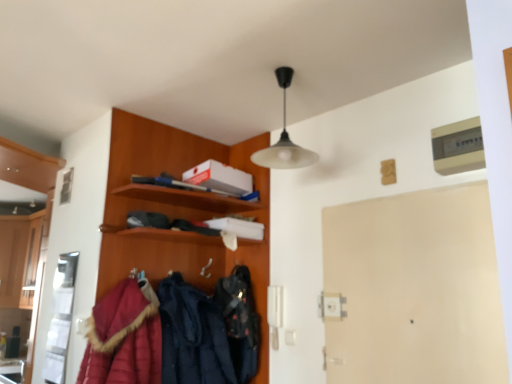
Question: Should I look upward or downward to see velvet black bag at center, acting as the 2th clothing starting from the left?

Choices:
 (A) down
 (B) up

Answer: (A)

Question: From the image's perspective, is quilted red coat at lower left over beige matte door at center?

Choices:
 (A) no
 (B) yes

Answer: (A)

Question: Is quilted red coat at lower left facing away from beige matte door at center?

Choices:
 (A) no
 (B) yes

Answer: (A)

Question: From a real-world perspective, is quilted red coat at lower left physically below beige matte door at center?

Choices:
 (A) yes
 (B) no

Answer: (A)

Question: Does quilted red coat at lower left have a lesser width compared to beige matte door at center?

Choices:
 (A) no
 (B) yes

Answer: (A)

Question: Are quilted red coat at lower left and beige matte door at center far apart?

Choices:
 (A) yes
 (B) no

Answer: (A)

Question: From the image's perspective, is quilted red coat at lower left below beige matte door at center?

Choices:
 (A) no
 (B) yes

Answer: (B)

Question: Is the depth of velvet black bag at center, positioned as the first clothing in right-to-left order, less than that of wooden coat rack at upper left?

Choices:
 (A) no
 (B) yes

Answer: (A)

Question: Does velvet black bag at center, positioned as the first clothing in right-to-left order, have a lesser width compared to wooden coat rack at upper left?

Choices:
 (A) yes
 (B) no

Answer: (A)

Question: Is velvet black bag at center, acting as the 2th clothing starting from the left, not inside wooden coat rack at upper left?

Choices:
 (A) no
 (B) yes

Answer: (A)

Question: Does velvet black bag at center, acting as the 2th clothing starting from the left, have a larger size compared to wooden coat rack at upper left?

Choices:
 (A) yes
 (B) no

Answer: (B)

Question: Is velvet black bag at center, acting as the 2th clothing starting from the left, aimed at wooden coat rack at upper left?

Choices:
 (A) yes
 (B) no

Answer: (A)

Question: Is velvet black bag at center, acting as the 2th clothing starting from the left, directly adjacent to wooden coat rack at upper left?

Choices:
 (A) no
 (B) yes

Answer: (A)

Question: Is wooden coat rack at upper left looking in the opposite direction of velvet black bag at center, positioned as the first clothing in right-to-left order?

Choices:
 (A) yes
 (B) no

Answer: (A)